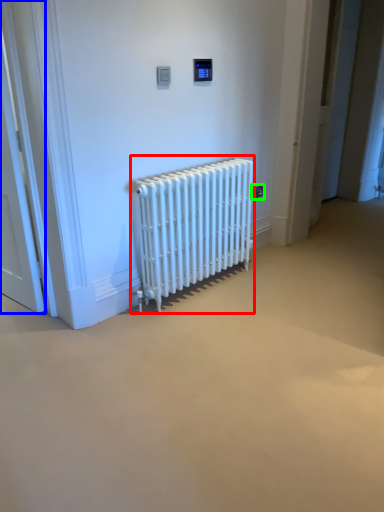
Question: Which object is the farthest from radiator (highlighted by a red box)? Choose among these: door (highlighted by a blue box) or electric outlet (highlighted by a green box).

Choices:
 (A) door
 (B) electric outlet

Answer: (A)